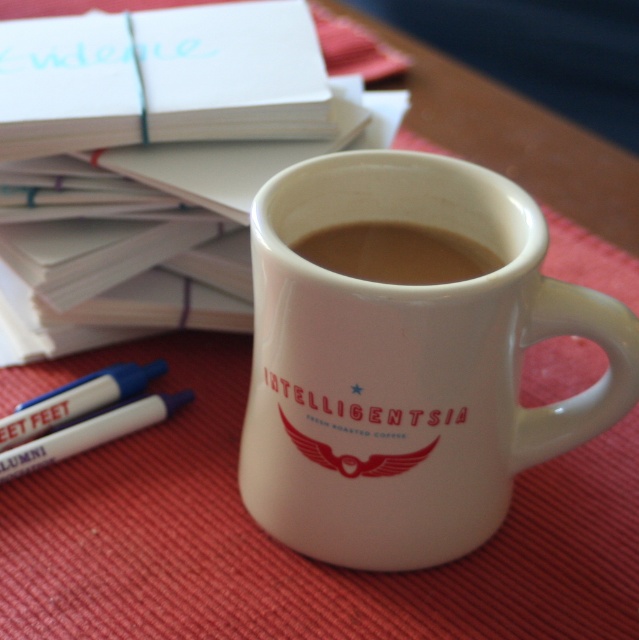
Is the position of brown matte coffee at center more distant than that of white paper at upper center?

That is False.

Does point (401, 257) come in front of point (17, 339)?

Yes, it is.

At what (x,y) coordinates should I click in order to perform the action: click on brown matte coffee at center. Please return your answer as a coordinate pair (x, y). Looking at the image, I should click on (396, 252).

Does white glossy mug at center have a larger size compared to brown matte coffee at center?

Indeed, white glossy mug at center has a larger size compared to brown matte coffee at center.

You are a GUI agent. You are given a task and a screenshot of the screen. Output one action in this format:
    pyautogui.click(x=<x>, y=<y>)
    Task: Click on the white glossy mug at center
    This screenshot has height=640, width=639.
    Given the screenshot: What is the action you would take?
    pyautogui.click(x=410, y=364)

Does white glossy mug at center appear over white paper at upper center?

Actually, white glossy mug at center is below white paper at upper center.

Which of these two, white glossy mug at center or white paper at upper center, stands taller?

With more height is white glossy mug at center.

Is point (293, 282) positioned before point (20, 314)?

Yes, it is in front of point (20, 314).

You are a GUI agent. You are given a task and a screenshot of the screen. Output one action in this format:
    pyautogui.click(x=<x>, y=<y>)
    Task: Click on the white glossy mug at center
    The width and height of the screenshot is (639, 640).
    Given the screenshot: What is the action you would take?
    pyautogui.click(x=410, y=364)